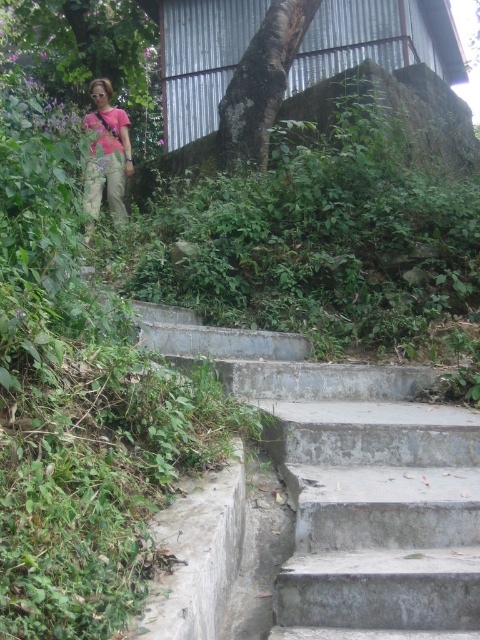
Can you confirm if gray concrete stairs at center is taller than pink matte shirt at upper left?

Incorrect, gray concrete stairs at center's height is not larger of pink matte shirt at upper left's.

Who is positioned more to the left, gray concrete stairs at center or pink matte shirt at upper left?

pink matte shirt at upper left is more to the left.

Is point (456, 628) behind point (123, 148)?

No.

The height and width of the screenshot is (640, 480). I want to click on gray concrete stairs at center, so click(352, 483).

Who is more forward, (x=340, y=390) or (x=261, y=106)?

Point (x=340, y=390) is more forward.

Can you confirm if gray concrete stairs at center is positioned to the left of dark brown bark tree at center?

Incorrect, gray concrete stairs at center is not on the left side of dark brown bark tree at center.

This screenshot has height=640, width=480. In order to click on gray concrete stairs at center in this screenshot , I will do `click(352, 483)`.

At what (x,y) coordinates should I click in order to perform the action: click on gray concrete stairs at center. Please return your answer as a coordinate pair (x, y). This screenshot has width=480, height=640. Looking at the image, I should click on (352, 483).

Which of these two, dark brown bark tree at center or pink matte shirt at upper left, stands taller?

pink matte shirt at upper left is taller.

Is point (266, 22) closer to viewer compared to point (107, 97)?

Yes, it is in front of point (107, 97).

Does point (251, 152) come in front of point (96, 172)?

Yes, it is in front of point (96, 172).

The width and height of the screenshot is (480, 640). Find the location of `dark brown bark tree at center`. dark brown bark tree at center is located at coordinates (261, 84).